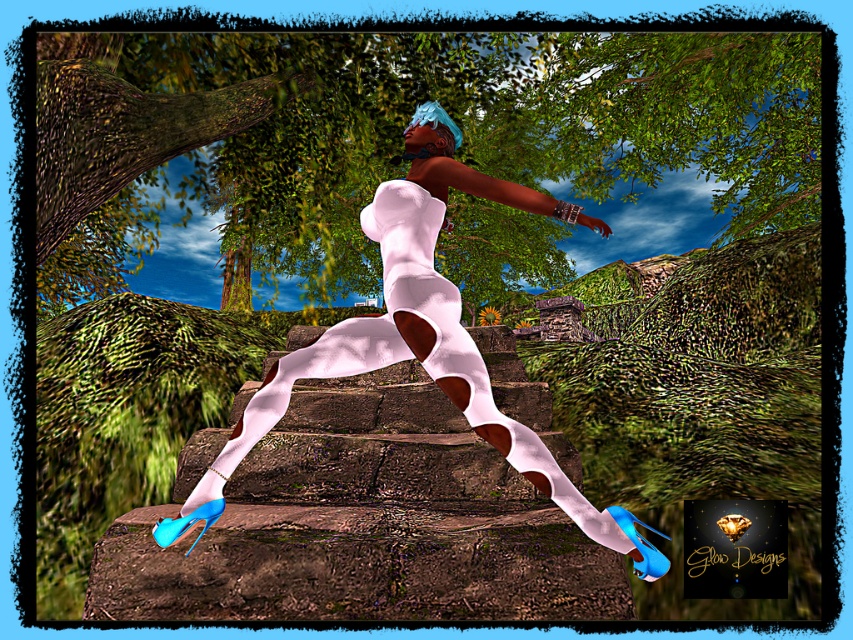
Can you confirm if green leafy tree at upper center is positioned to the left of matte white leggings at center?

Yes, green leafy tree at upper center is to the left of matte white leggings at center.

Does point (305, 76) come farther from viewer compared to point (428, 134)?

Yes, point (305, 76) is farther from viewer.

At what (x,y) coordinates should I click in order to perform the action: click on green leafy tree at upper center. Please return your answer as a coordinate pair (x, y). The width and height of the screenshot is (853, 640). Looking at the image, I should click on (393, 134).

Who is higher up, matte white leggings at center or white matte leggings at center?

Positioned higher is matte white leggings at center.

This screenshot has width=853, height=640. What do you see at coordinates (419, 339) in the screenshot? I see `matte white leggings at center` at bounding box center [419, 339].

This screenshot has width=853, height=640. Identify the location of matte white leggings at center. (419, 339).

Between point (393, 100) and point (427, 360), which one is positioned behind?

The point (393, 100) is more distant.

Is green leafy tree at upper center closer to camera compared to white matte leggings at center?

No, green leafy tree at upper center is further to the viewer.

Is point (204, 208) positioned behind point (300, 374)?

Yes, it is.

Where is `green leafy tree at upper center`? This screenshot has height=640, width=853. green leafy tree at upper center is located at coordinates (393, 134).